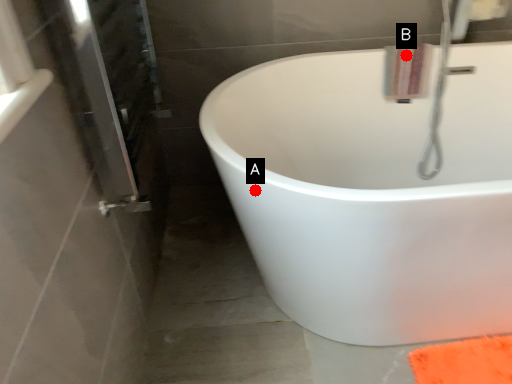
Question: Two points are circled on the image, labeled by A and B beside each circle. Among these points, which one is farthest from the camera?

Choices:
 (A) A is further
 (B) B is further

Answer: (B)